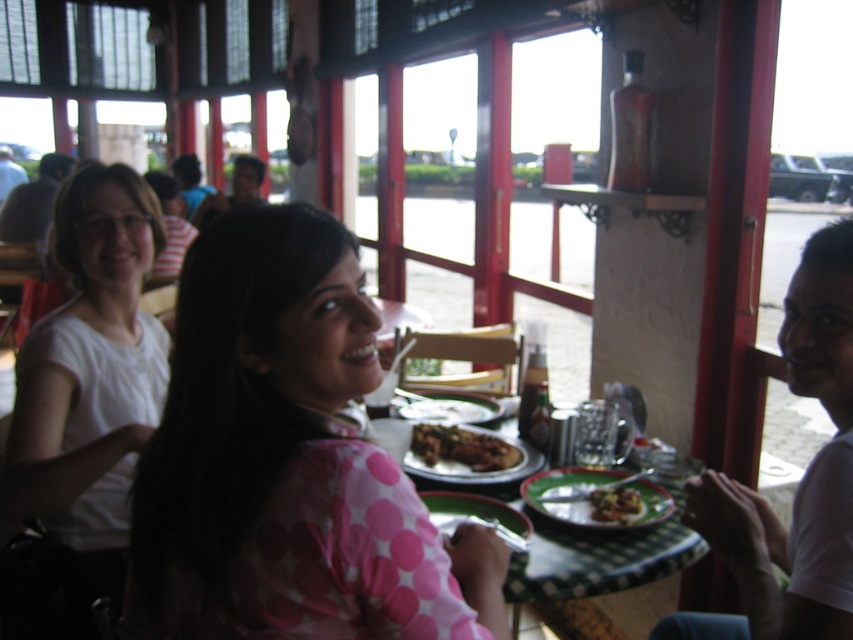
Question: Which object is farther from the camera taking this photo?

Choices:
 (A) shiny brown meat at lower right
 (B) brown crispy bread at center
 (C) white matte shirt at right
 (D) pink dotted shirt at center

Answer: (B)

Question: Is pink dotted shirt at center behind dark brown hair at upper left?

Choices:
 (A) yes
 (B) no

Answer: (B)

Question: Is green matte plate at lower center below matte white shirt at upper left?

Choices:
 (A) no
 (B) yes

Answer: (B)

Question: Which object appears closest to the camera in this image?

Choices:
 (A) green checkered table at center
 (B) dark brown hair at upper left
 (C) green matte plate at lower center

Answer: (A)

Question: Does pink dotted shirt at center appear over white matte shirt at right?

Choices:
 (A) yes
 (B) no

Answer: (A)

Question: Which object appears farthest from the camera in this image?

Choices:
 (A) green checkered table at center
 (B) brown crispy bread at center

Answer: (B)